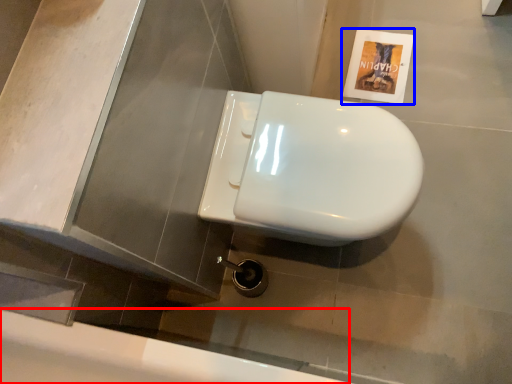
Question: Among these objects, which one is nearest to the camera, bath (highlighted by a red box) or flyer (highlighted by a blue box)?

Choices:
 (A) bath
 (B) flyer

Answer: (A)